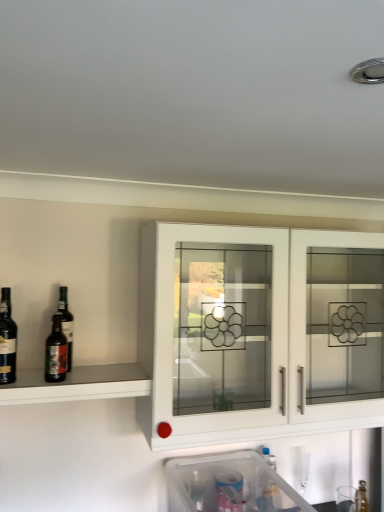
Question: Is dark brown glass bottle at left, which appears as the 2th wine when viewed from the right, thinner than clear glass bottle at lower right?

Choices:
 (A) yes
 (B) no

Answer: (B)

Question: Can you see dark brown glass bottle at left, placed as the first wine when sorted from left to right, touching clear glass bottle at lower right?

Choices:
 (A) yes
 (B) no

Answer: (B)

Question: Can you confirm if dark brown glass bottle at left, placed as the first wine when sorted from left to right, is taller than clear glass bottle at lower right?

Choices:
 (A) no
 (B) yes

Answer: (B)

Question: Is clear glass bottle at lower right a part of dark brown glass bottle at left, placed as the first wine when sorted from left to right?

Choices:
 (A) no
 (B) yes

Answer: (A)

Question: Is dark brown glass bottle at left, placed as the first wine when sorted from left to right, positioned before clear glass bottle at lower right?

Choices:
 (A) no
 (B) yes

Answer: (B)

Question: Is dark brown glass bottle at left, which appears as the 2th wine when viewed from the right, to the left of clear glass bottle at lower right from the viewer's perspective?

Choices:
 (A) yes
 (B) no

Answer: (A)

Question: From the image's perspective, is white glossy cabinet at center beneath clear plastic container at lower center?

Choices:
 (A) no
 (B) yes

Answer: (A)

Question: Is the depth of white glossy cabinet at center less than that of clear plastic container at lower center?

Choices:
 (A) no
 (B) yes

Answer: (A)

Question: From a real-world perspective, is white glossy cabinet at center positioned over clear plastic container at lower center based on gravity?

Choices:
 (A) no
 (B) yes

Answer: (B)

Question: Can you confirm if white glossy cabinet at center is positioned to the right of clear plastic container at lower center?

Choices:
 (A) yes
 (B) no

Answer: (A)

Question: Can you confirm if white glossy cabinet at center is smaller than clear plastic container at lower center?

Choices:
 (A) yes
 (B) no

Answer: (B)

Question: Would you say white glossy cabinet at center is a long distance from clear plastic container at lower center?

Choices:
 (A) no
 (B) yes

Answer: (A)

Question: From a real-world perspective, is white glossy cabinet at center on clear glass bottle at lower right?

Choices:
 (A) no
 (B) yes

Answer: (B)